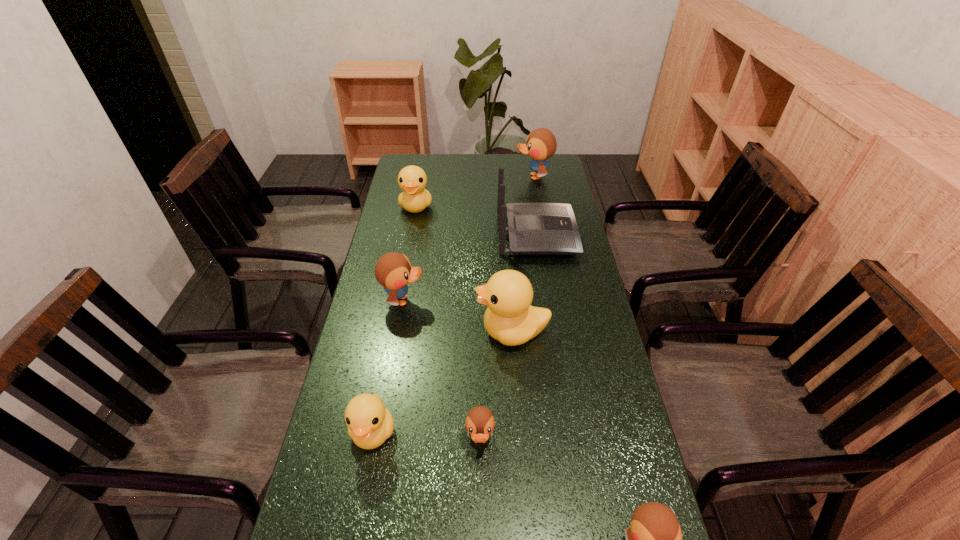
The width and height of the screenshot is (960, 540). Find the location of `the farthest duck`. the farthest duck is located at coordinates (541, 144).

Image resolution: width=960 pixels, height=540 pixels. Identify the location of the farthest object. (541, 144).

The image size is (960, 540). In order to click on the rightmost yellow duck in this screenshot , I will do `click(510, 318)`.

Identify the location of the second farthest yellow duck. Image resolution: width=960 pixels, height=540 pixels. (510, 318).

At what (x,y) coordinates should I click in order to perform the action: click on router. Please return your answer as a coordinate pair (x, y). Looking at the image, I should click on (534, 228).

The image size is (960, 540). I want to click on the farthest yellow duck, so (412, 180).

Where is `the second smallest yellow duck`? the second smallest yellow duck is located at coordinates (412, 180).

Locate an element on the screen. Image resolution: width=960 pixels, height=540 pixels. the third smallest blue duck is located at coordinates (393, 270).

Where is `the third nearest blue duck`? This screenshot has width=960, height=540. the third nearest blue duck is located at coordinates (393, 270).

What are the coordinates of `the smallest yellow duck` in the screenshot? It's located at (369, 423).